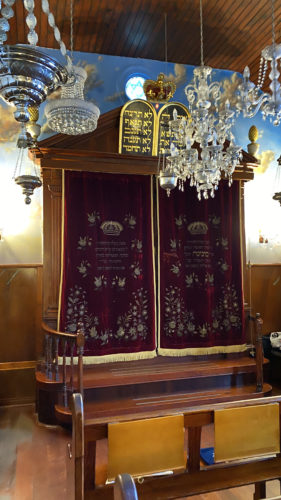
Identify the location of floor. The width and height of the screenshot is (281, 500). pyautogui.click(x=63, y=473).